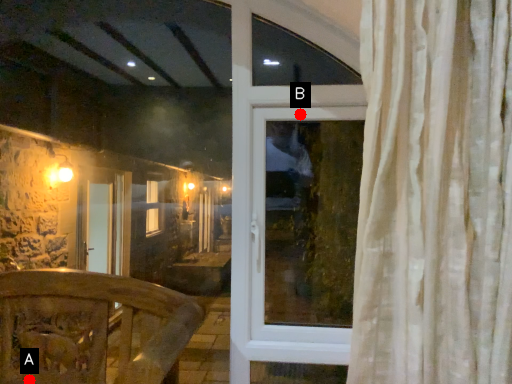
Question: Two points are circled on the image, labeled by A and B beside each circle. Which of the following is the farthest from the observer?

Choices:
 (A) A is further
 (B) B is further

Answer: (B)